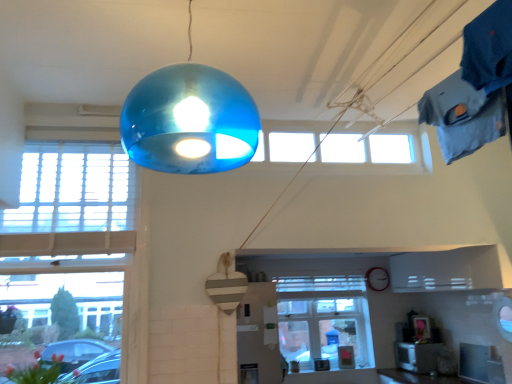
Question: From the image's perspective, is vivid pink petals at lower left above or below transparent glass window at upper center, placed as the 2th window when sorted from right to left?

Choices:
 (A) above
 (B) below

Answer: (B)

Question: Considering the positions of vivid pink petals at lower left and transparent glass window at upper center, arranged as the second window when viewed from the front, in the image, is vivid pink petals at lower left wider or thinner than transparent glass window at upper center, arranged as the second window when viewed from the front,?

Choices:
 (A) wide
 (B) thin

Answer: (A)

Question: Which object is positioned farthest from the clear glass window at center, arranged as the 3th window when viewed from the front?

Choices:
 (A) vivid pink petals at lower left
 (B) transparent glass window at upper center, which is the second window in left-to-right order
 (C) white wooden window at left, which is the 1th window in front-to-back order

Answer: (A)

Question: Considering the real-world distances, which object is closest to the transparent glass window at upper center, placed as the 2th window when sorted from right to left?

Choices:
 (A) white wooden window at left, which is the 1th window in front-to-back order
 (B) clear glass window at center, which ranks as the first window in right-to-left order
 (C) vivid pink petals at lower left

Answer: (A)